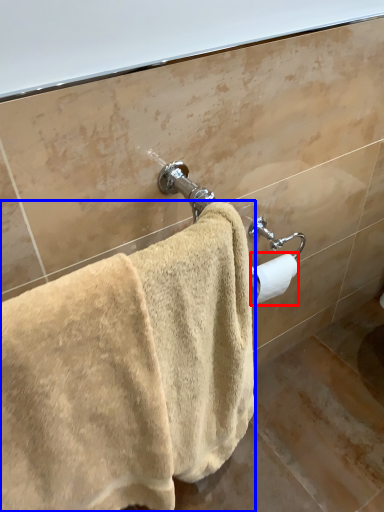
Question: Which point is closer to the camera, toilet paper (highlighted by a red box) or towel (highlighted by a blue box)?

Choices:
 (A) toilet paper
 (B) towel

Answer: (B)